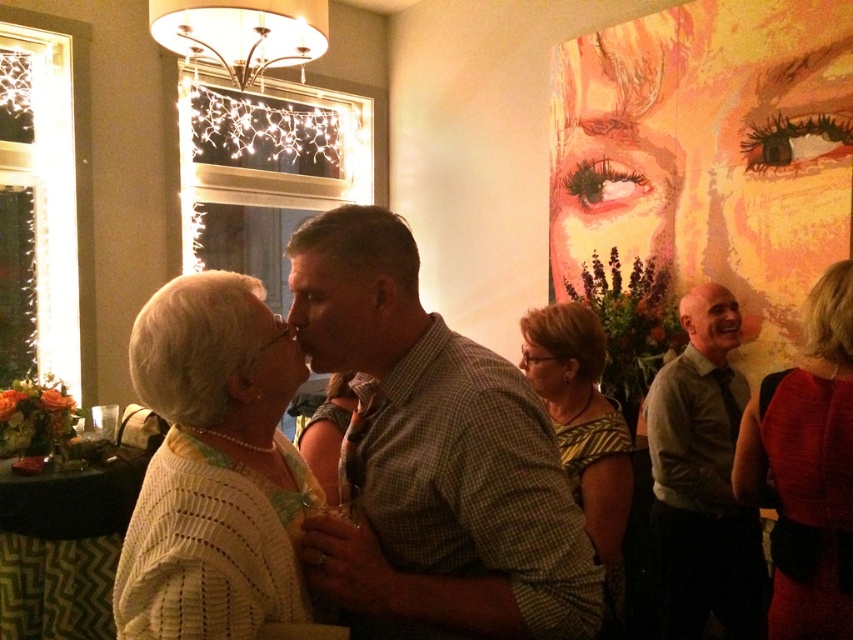
Is white knitted sweater at center bigger than striped blouse at center?

No, white knitted sweater at center is not bigger than striped blouse at center.

Who is more forward, (142, 627) or (605, 464)?

Point (142, 627)

In order to click on white knitted sweater at center in this screenshot , I will do `click(213, 467)`.

Does green checkered shirt at center have a greater width compared to white knitted sweater at center?

Yes.

Between point (538, 486) and point (190, 580), which one is positioned behind?

The point (538, 486) is more distant.

Where is `green checkered shirt at center`? green checkered shirt at center is located at coordinates (432, 458).

Can you confirm if green checkered shirt at center is positioned above green shirt at right?

Yes.

Is the position of green checkered shirt at center less distant than that of green shirt at right?

That is True.

I want to click on green checkered shirt at center, so click(432, 458).